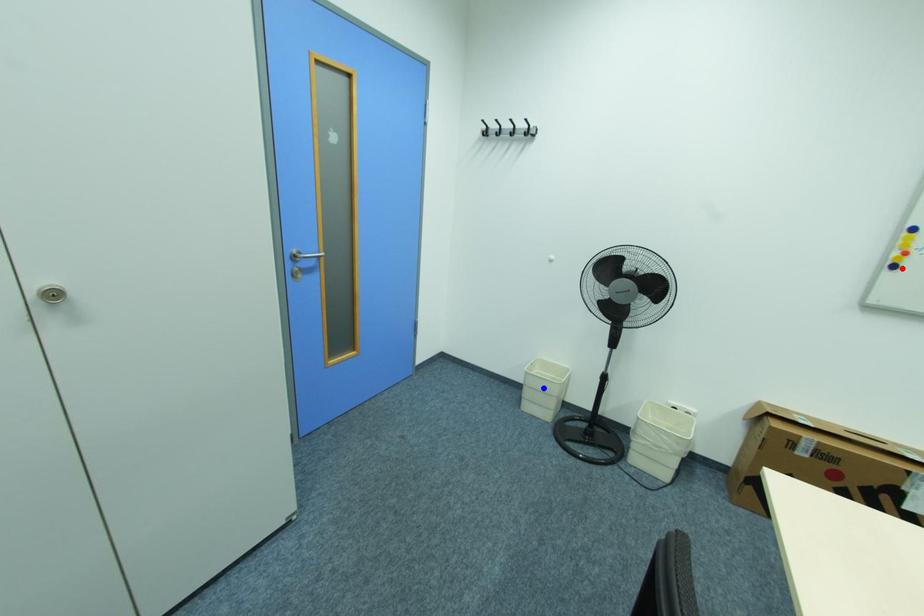
Question: Which of the two points in the image is closer to the camera?

Choices:
 (A) Blue point is closer.
 (B) Red point is closer.

Answer: (B)